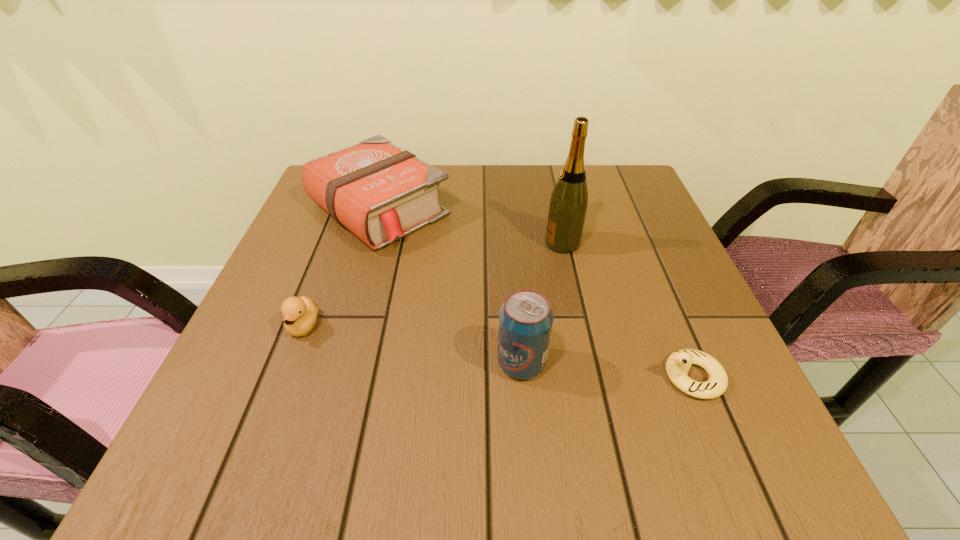
Identify the location of the tallest object. Image resolution: width=960 pixels, height=540 pixels. (568, 204).

Locate an element on the screen. The width and height of the screenshot is (960, 540). the fourth object from left to right is located at coordinates (568, 204).

Find the location of a particular element. The image size is (960, 540). the fourth shortest object is located at coordinates pos(525,319).

The height and width of the screenshot is (540, 960). In order to click on the third object from right to left in this screenshot , I will do `click(525, 319)`.

Where is `Bible`? This screenshot has height=540, width=960. Bible is located at coordinates (379, 192).

Locate an element on the screen. the third nearest object is located at coordinates (299, 314).

You are a GUI agent. You are given a task and a screenshot of the screen. Output one action in this format:
    pyautogui.click(x=<x>, y=<y>)
    Task: Click on the left duckling
    This screenshot has width=960, height=540.
    Given the screenshot: What is the action you would take?
    pyautogui.click(x=299, y=314)

At what (x,y) coordinates should I click in order to perform the action: click on the nearer duckling. Please return your answer as a coordinate pair (x, y). The width and height of the screenshot is (960, 540). Looking at the image, I should click on (678, 364).

This screenshot has height=540, width=960. What are the coordinates of `the shorter duckling` in the screenshot? It's located at (678, 364).

In order to click on vacant space located 0.340m on the front-facing side of the wine bottle in this screenshot , I will do `click(392, 243)`.